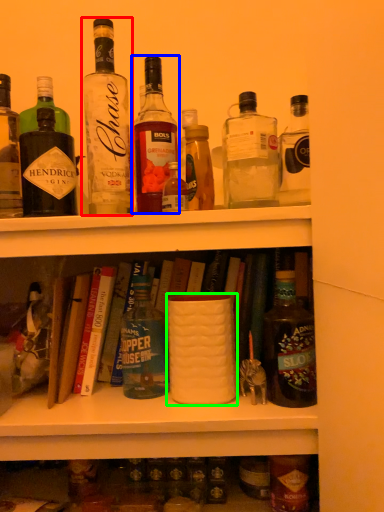
Question: Based on their relative distances, which object is farther from bottle (highlighted by a red box)? Choose from bottle (highlighted by a blue box) and coffee cup (highlighted by a green box).

Choices:
 (A) bottle
 (B) coffee cup

Answer: (B)